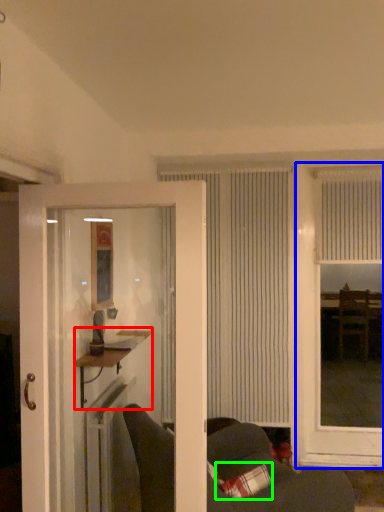
Question: Based on their relative distances, which object is farther from table (highlighted by a red box)? Choose from window (highlighted by a blue box) and pillow (highlighted by a green box).

Choices:
 (A) window
 (B) pillow

Answer: (A)